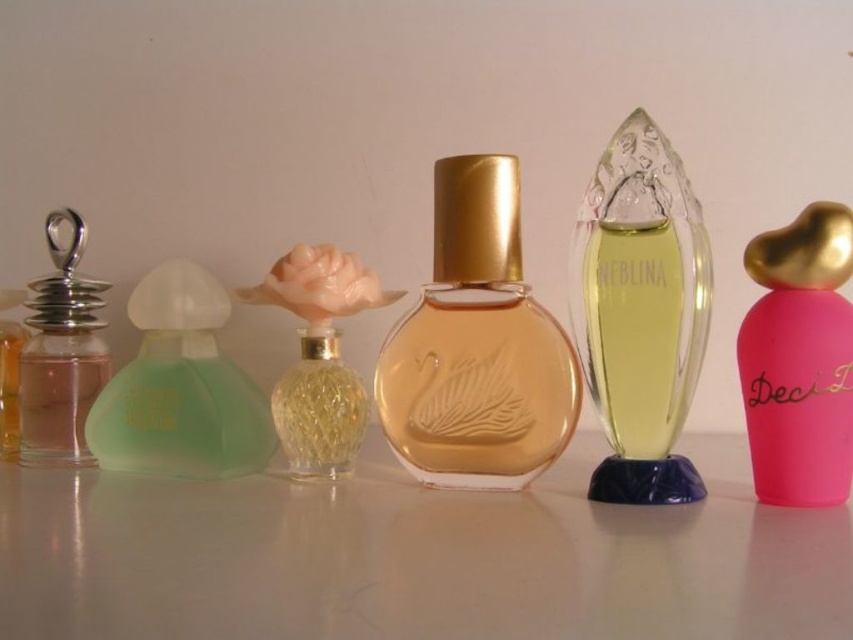
How far apart are white glossy table at center and pink matte bottle at right?

white glossy table at center and pink matte bottle at right are 11.90 inches apart from each other.

Can you confirm if white glossy table at center is positioned to the right of pink matte bottle at right?

No, white glossy table at center is not to the right of pink matte bottle at right.

Is point (525, 528) farther from viewer compared to point (802, 227)?

No, (525, 528) is in front of (802, 227).

Identify the location of white glossy table at center. (416, 556).

Is green frosted glass perfume at center left to the left of silver metallic perfume at left from the viewer's perspective?

In fact, green frosted glass perfume at center left is to the right of silver metallic perfume at left.

Who is positioned more to the right, green frosted glass perfume at center left or silver metallic perfume at left?

green frosted glass perfume at center left is more to the right.

Who is more distant from viewer, (227, 168) or (73, 259)?

Point (227, 168)

Image resolution: width=853 pixels, height=640 pixels. In order to click on green frosted glass perfume at center left in this screenshot , I will do `click(653, 260)`.

Is white glossy table at center above green frosted glass perfume at center left?

Incorrect, white glossy table at center is not positioned above green frosted glass perfume at center left.

Does white glossy table at center have a greater height compared to green frosted glass perfume at center left?

In fact, white glossy table at center may be shorter than green frosted glass perfume at center left.

Locate an element on the screen. This screenshot has width=853, height=640. white glossy table at center is located at coordinates (416, 556).